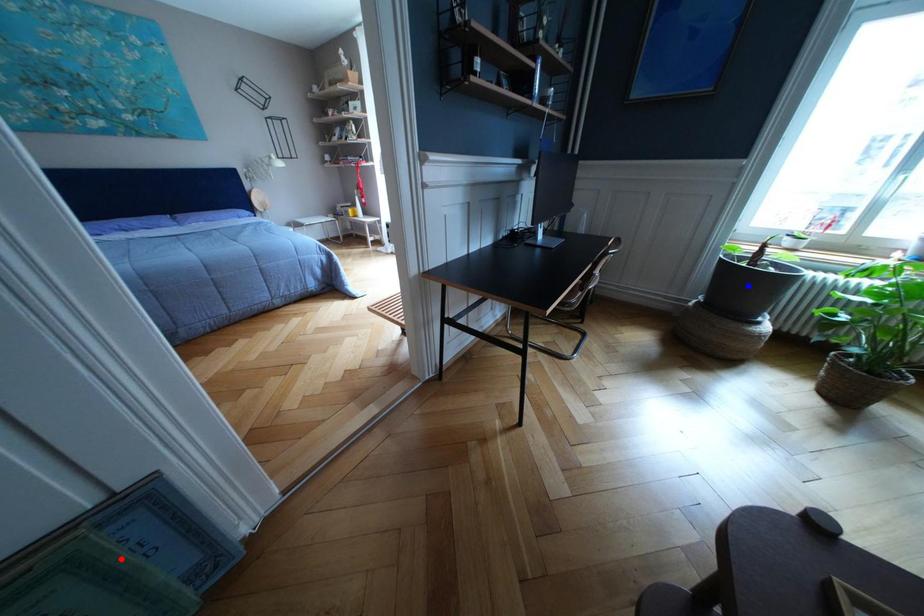
Question: In the image, two points are highlighted. Which point is nearer to the camera? Reply with the corresponding letter.

Choices:
 (A) blue point
 (B) red point

Answer: (B)